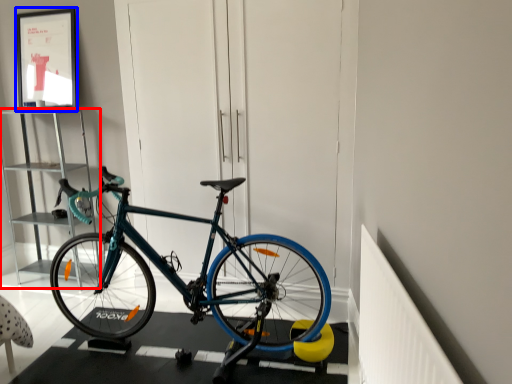
Question: Which of the following is the farthest to the observer, cabinet (highlighted by a red box) or picture frame (highlighted by a blue box)?

Choices:
 (A) cabinet
 (B) picture frame

Answer: (B)